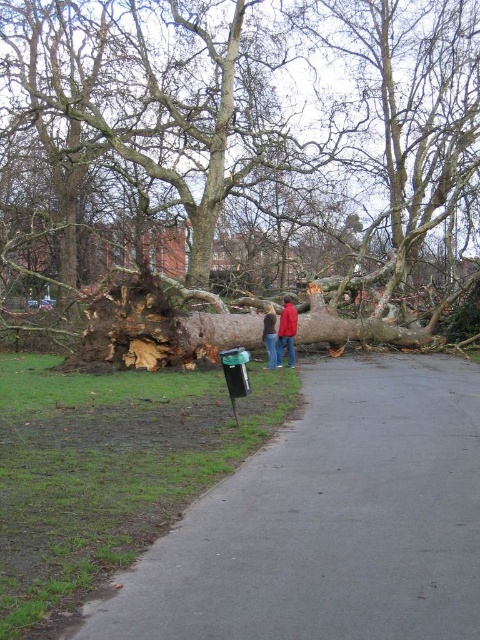
Question: Which point is closer to the camera taking this photo?

Choices:
 (A) (62, 243)
 (B) (259, 340)
 (C) (256, 528)
 (D) (273, 353)

Answer: (C)

Question: Which of these objects is positioned closest to the brown rough bark tree at center?

Choices:
 (A) brown rough log at center
 (B) red jacket at center
 (C) gray asphalt pavement at lower left
 (D) red fabric jacket at center

Answer: (A)

Question: Is brown rough bark tree at center wider than brown rough log at center?

Choices:
 (A) yes
 (B) no

Answer: (A)

Question: Among these points, which one is nearest to the camera?

Choices:
 (A) (279, 332)
 (B) (200, 625)
 (C) (266, 312)
 (D) (186, 67)

Answer: (B)

Question: Is gray asphalt pavement at lower left to the right of brown rough log at center from the viewer's perspective?

Choices:
 (A) no
 (B) yes

Answer: (A)

Question: Does gray asphalt pavement at lower left appear on the right side of brown rough log at center?

Choices:
 (A) no
 (B) yes

Answer: (A)